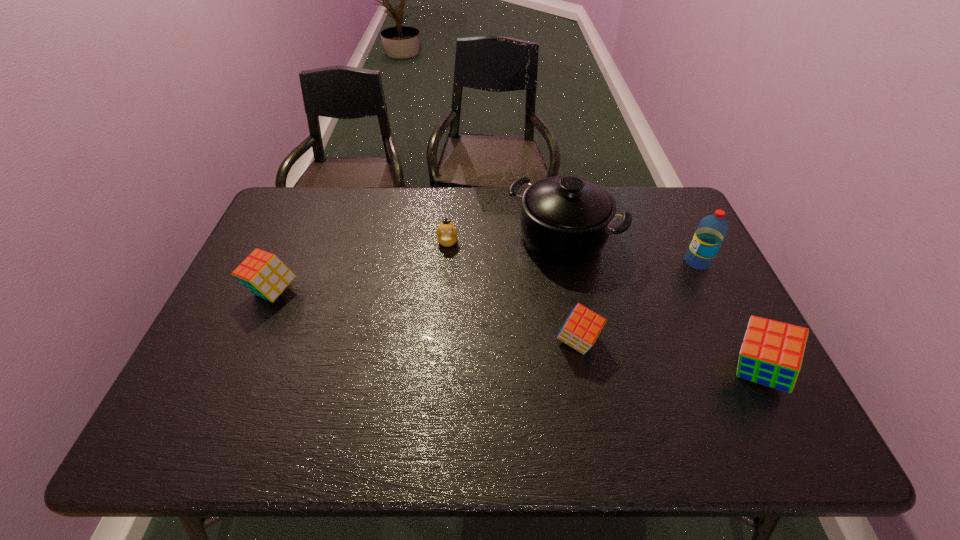
Where is `spot to insert another cube for uniform distribution`? The height and width of the screenshot is (540, 960). spot to insert another cube for uniform distribution is located at coordinates (418, 315).